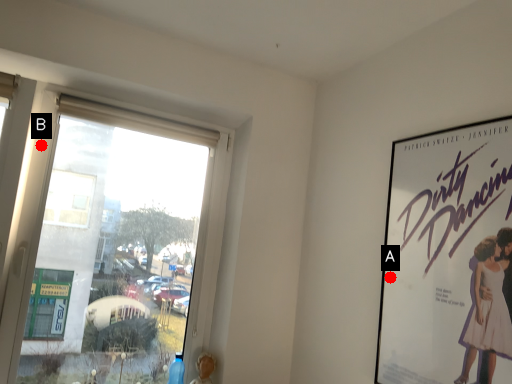
Question: Two points are circled on the image, labeled by A and B beside each circle. Which point is closer to the camera?

Choices:
 (A) A is closer
 (B) B is closer

Answer: (A)